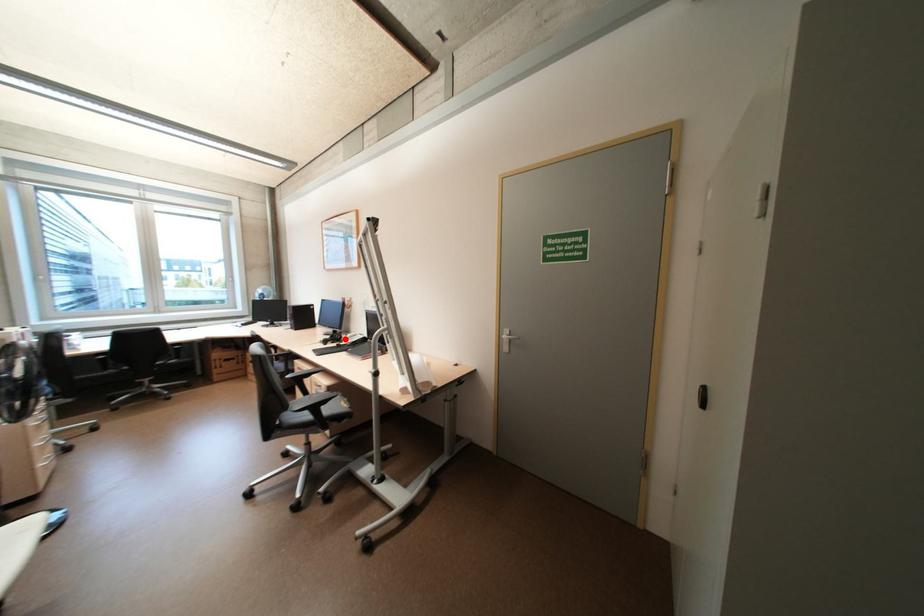
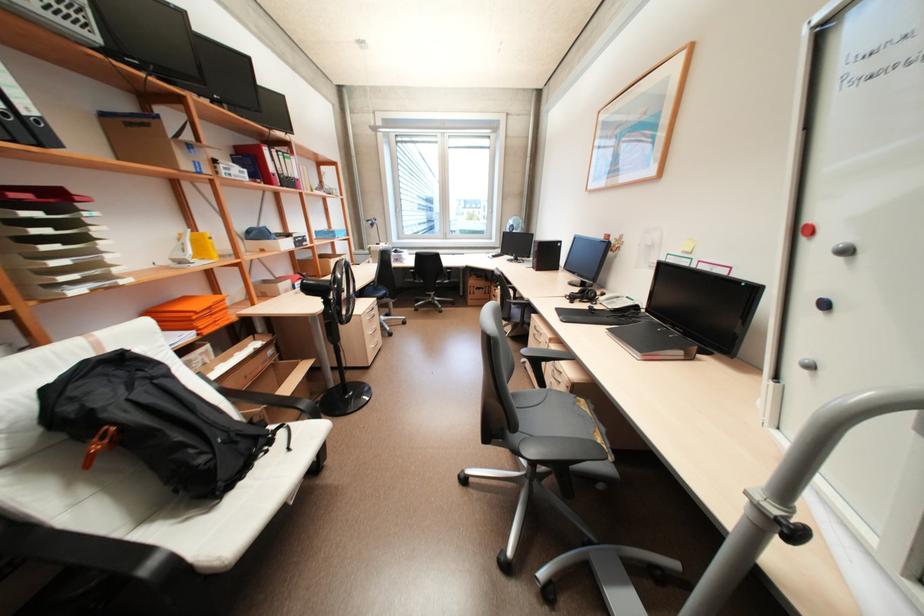
Find the pixel in the second image that matches the highlighted location in the first image.

(598, 299)